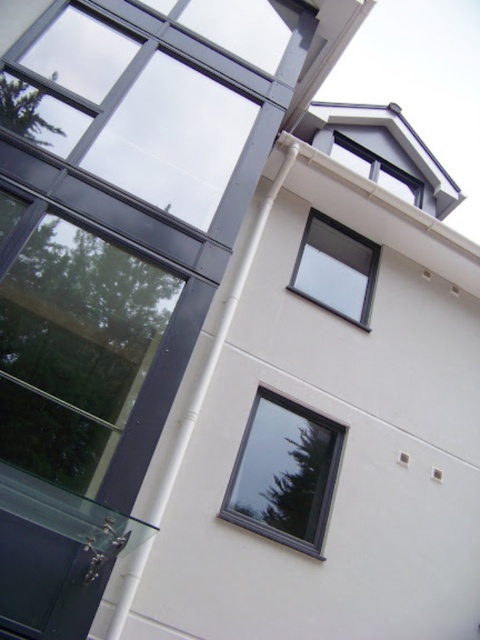
Can you confirm if black glass window at center is wider than white plastic window at upper right?

No, black glass window at center is not wider than white plastic window at upper right.

Is black glass window at center smaller than white plastic window at upper right?

A: Incorrect, black glass window at center is not smaller in size than white plastic window at upper right.

What do you see at coordinates (285, 474) in the screenshot? The width and height of the screenshot is (480, 640). I see `black glass window at center` at bounding box center [285, 474].

At what (x,y) coordinates should I click in order to perform the action: click on black glass window at center. Please return your answer as a coordinate pair (x, y). The height and width of the screenshot is (640, 480). Looking at the image, I should click on (285, 474).

Can you confirm if black glass window at center is bigger than transparent glass window at upper center?

Yes.

Is point (335, 436) less distant than point (350, 285)?

Yes, it is in front of point (350, 285).

The width and height of the screenshot is (480, 640). Identify the location of black glass window at center. (285, 474).

Can you confirm if transparent glass window at upper center is positioned above white plastic window at upper right?

Actually, transparent glass window at upper center is below white plastic window at upper right.

Locate an element on the screen. The width and height of the screenshot is (480, 640). transparent glass window at upper center is located at coordinates (336, 268).